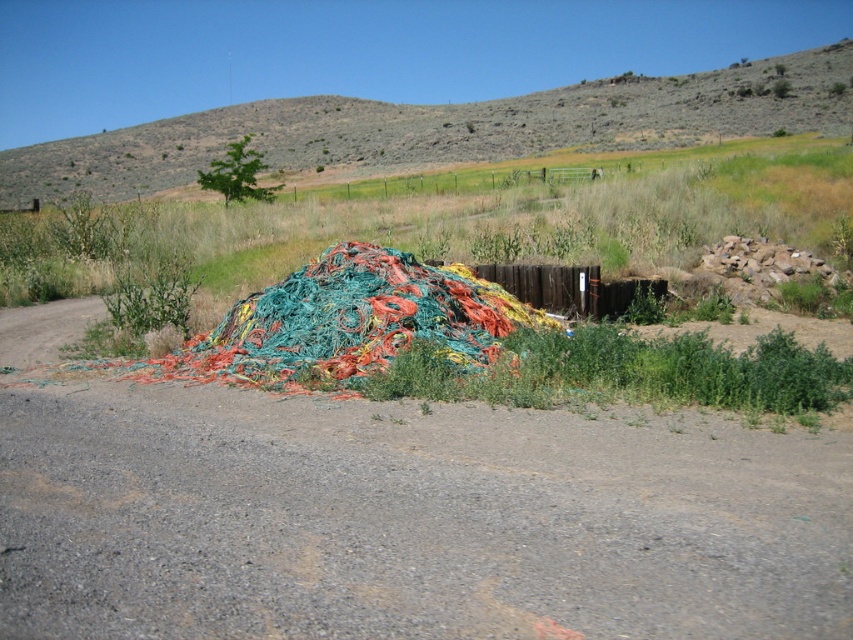
Is dirt track at center to the left of dried grass at upper center from the viewer's perspective?

In fact, dirt track at center is to the right of dried grass at upper center.

Is dirt track at center positioned before dried grass at upper center?

Yes, it is in front of dried grass at upper center.

Does point (485, 435) come in front of point (700, 125)?

Yes, it is in front of point (700, 125).

The width and height of the screenshot is (853, 640). Identify the location of dirt track at center. (410, 518).